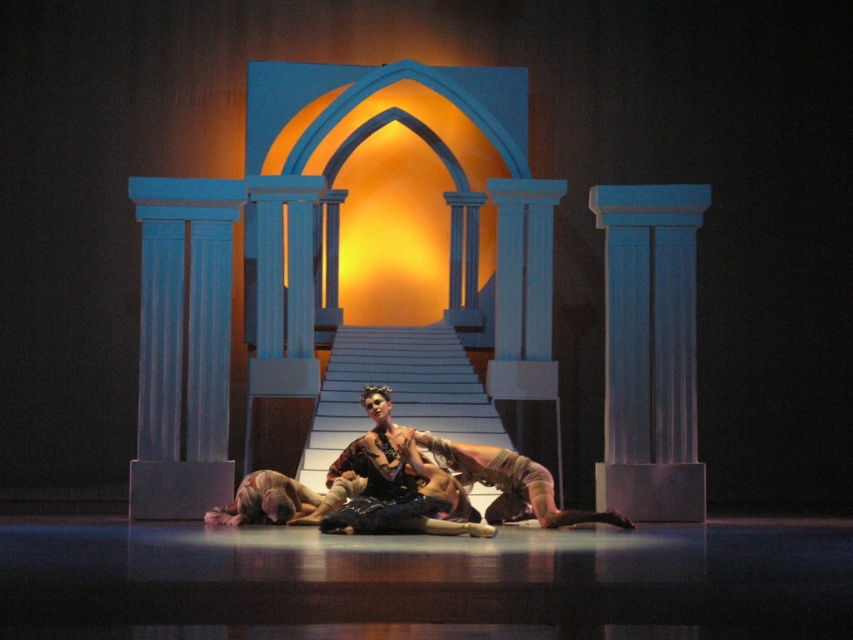
You are a stagehand who needs to place a 1 meter long decorative pole between the shiny black dress at center and the tan leather pants at center. Based on the scene description, will the pole fit between them without overlapping either?

The distance between the shiny black dress at center and the tan leather pants at center is 81.07 centimeters. Since the pole is 1 meter long, which is 100 centimeters, it will not fit between them without overlapping either object.

You are a photographer capturing the stage scene. You notice the shiny black dress at center and the tan leather pants at center. Which one is located to the left when viewed from the audience perspective?

The shiny black dress at center is positioned on the left side of tan leather pants at center, so it is located to the left when viewed from the audience perspective.

You are a stagehand preparing to place a new spotlight on the stage. The spotlight has a narrow beam that can only illuminate a small area. Based on the image, where should you aim the spotlight to ensure it directly hits the shiny black dress at center?

You should aim the spotlight at point (397,483) to directly hit the shiny black dress at center.